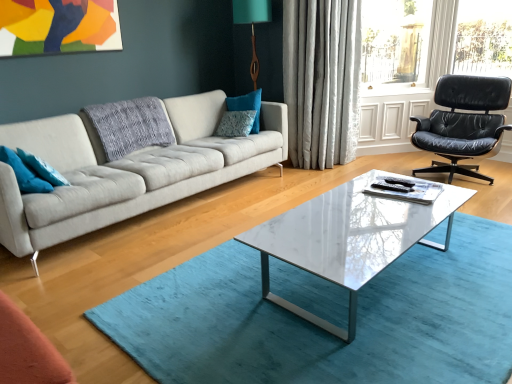
Question: From a real-world perspective, does white marble coffee table at center stand above silky gray curtain at upper right?

Choices:
 (A) yes
 (B) no

Answer: (B)

Question: Is white marble coffee table at center thinner than silky gray curtain at upper right?

Choices:
 (A) yes
 (B) no

Answer: (B)

Question: Is white marble coffee table at center beside silky gray curtain at upper right?

Choices:
 (A) no
 (B) yes

Answer: (A)

Question: Can you confirm if white marble coffee table at center is bigger than silky gray curtain at upper right?

Choices:
 (A) yes
 (B) no

Answer: (B)

Question: Can you confirm if white marble coffee table at center is smaller than silky gray curtain at upper right?

Choices:
 (A) yes
 (B) no

Answer: (A)

Question: From the image's perspective, is white marble coffee table at center beneath silky gray curtain at upper right?

Choices:
 (A) yes
 (B) no

Answer: (A)

Question: Is white marble coffee table at center thinner than teal fabric pillow at center, placed as the fourth pillow when sorted from left to right?

Choices:
 (A) no
 (B) yes

Answer: (A)

Question: Is white marble coffee table at center facing away from teal fabric pillow at center, the first pillow when ordered from back to front?

Choices:
 (A) yes
 (B) no

Answer: (B)

Question: Could you tell me if white marble coffee table at center is facing teal fabric pillow at center, the first pillow when ordered from back to front?

Choices:
 (A) yes
 (B) no

Answer: (B)

Question: Does white marble coffee table at center touch teal fabric pillow at center, the first pillow when ordered from back to front?

Choices:
 (A) yes
 (B) no

Answer: (B)

Question: Does white marble coffee table at center have a smaller size compared to teal fabric pillow at center, the first pillow when ordered from back to front?

Choices:
 (A) yes
 (B) no

Answer: (B)

Question: From the image's perspective, is white marble coffee table at center on teal fabric pillow at center, the 1th pillow in the right-to-left sequence?

Choices:
 (A) yes
 (B) no

Answer: (B)

Question: Is white marble coffee table at center facing towards teal fabric pillow at left, positioned as the first pillow in left-to-right order?

Choices:
 (A) yes
 (B) no

Answer: (B)